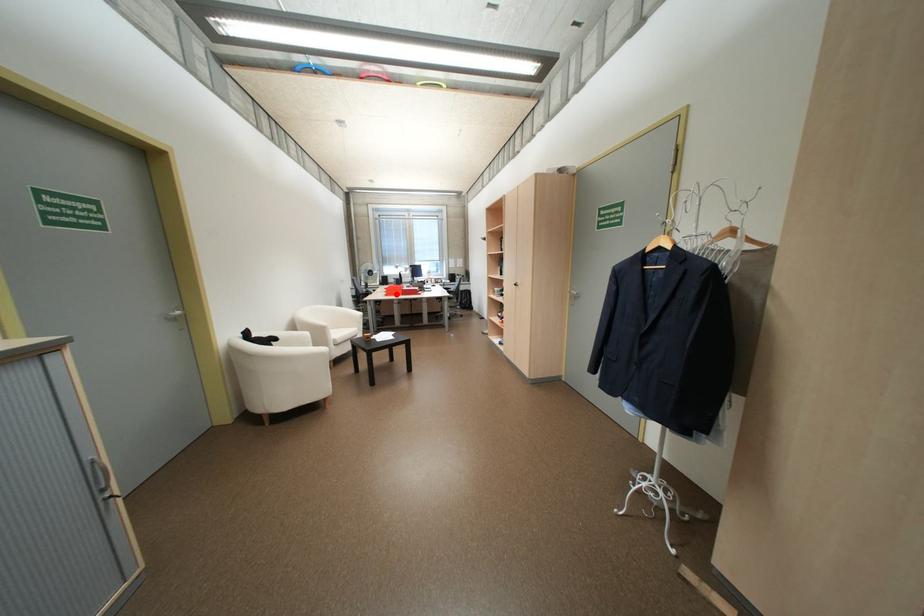
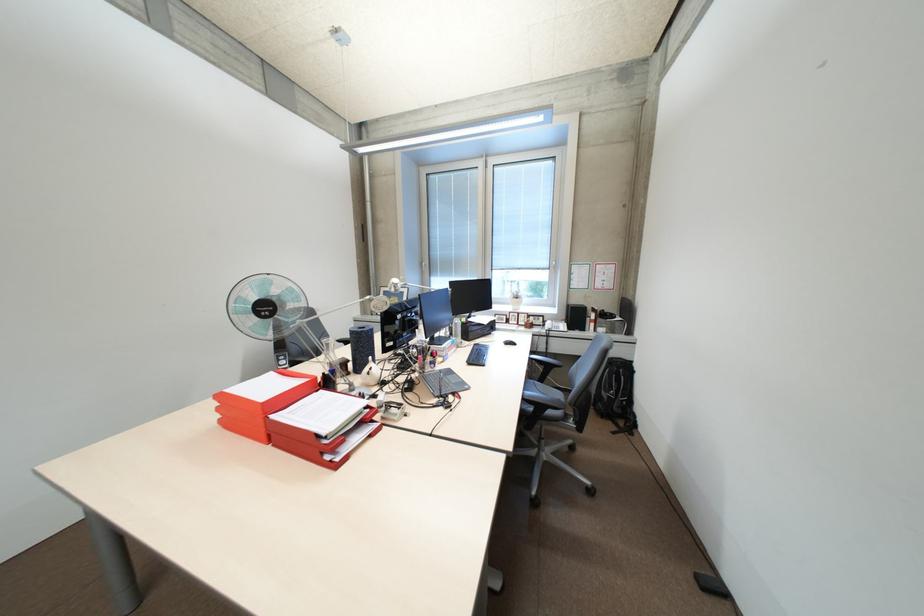
Locate, in the second image, the point that corresponds to the highlighted location in the first image.

(231, 421)